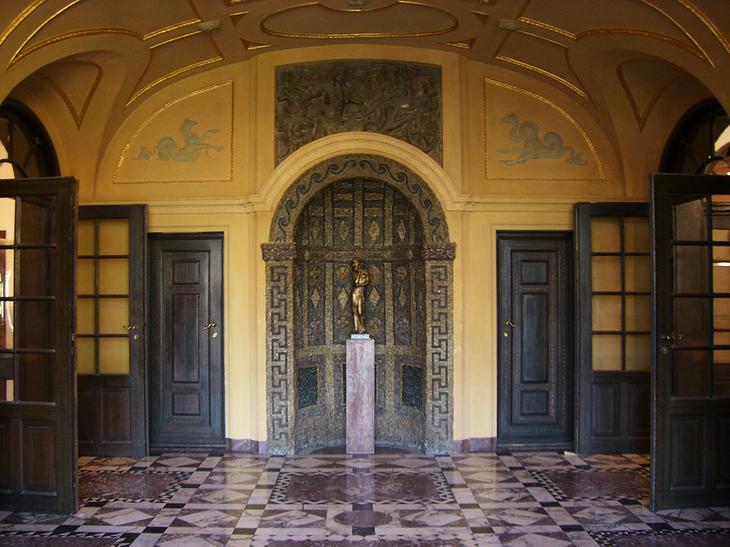
You are a GUI agent. You are given a task and a screenshot of the screen. Output one action in this format:
    pyautogui.click(x=<x>, y=<y>)
    Task: Click on the closed door
    The image size is (730, 547).
    Given the screenshot: What is the action you would take?
    pyautogui.click(x=537, y=358), pyautogui.click(x=195, y=365)